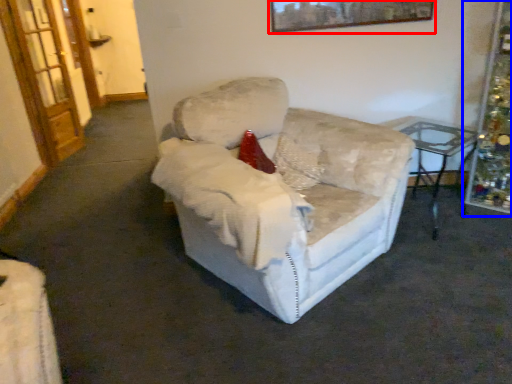
Question: Which of the following is the farthest to the observer, picture frame (highlighted by a red box) or christmas decoration (highlighted by a blue box)?

Choices:
 (A) picture frame
 (B) christmas decoration

Answer: (A)